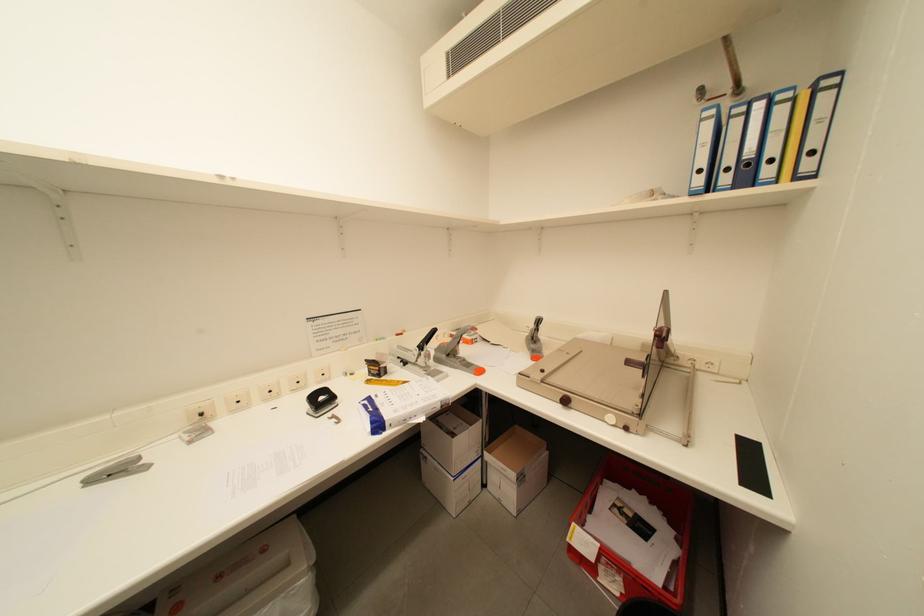
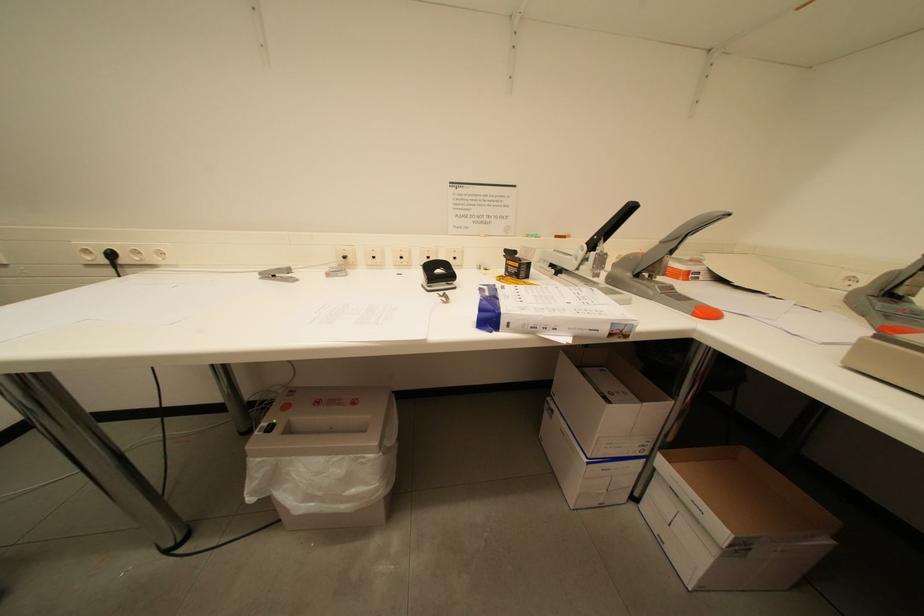
Question: Based on the continuous images, in which direction is the camera rotating? Reply with the corresponding letter.

Choices:
 (A) Left
 (B) Right
 (C) Up
 (D) Down

Answer: (A)